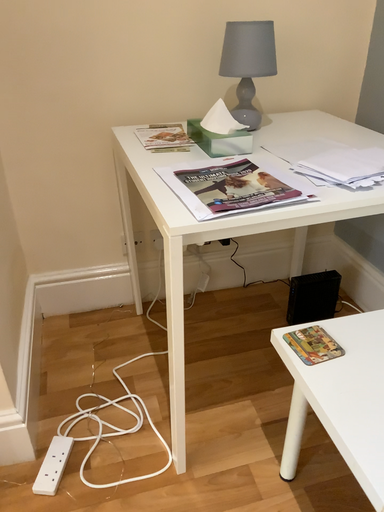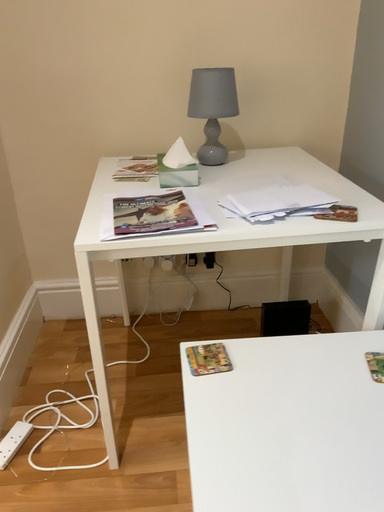
Question: How did the camera likely rotate when shooting the video?

Choices:
 (A) rotated right
 (B) rotated left

Answer: (B)